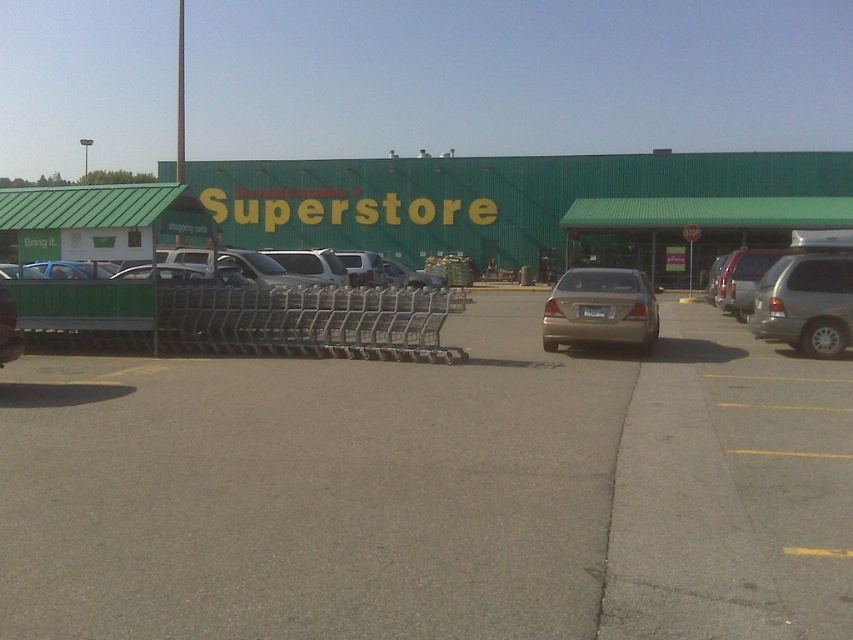
You are a delivery driver who needs to park your truck in the parking lot. You see a matte silver suv at center and a matte silver sedan at center. Which vehicle should you avoid parking too close to to prevent blocking the other?

You should avoid parking too close to the matte silver suv at center because it is positioned under the matte silver sedan at center, meaning it might be in a lower parking space or closer to the ground, and blocking it could obstruct access to the sedan above.

Based on the photo, you are driving a car that is 5 meters long and need to park in the parking lot shown. The satin silver suv at right is parked 14.26 meters away from the beige sedan near the center. Is there enough space between them to park your car?

The satin silver suv at right and the beige sedan near the center are 14.26 meters apart. Since your car is only 5 meters long, there is sufficient space between them to park your car.

You are a customer arriving at the Superstore parking lot. You see a gold matte sedan at center and a matte silver suv at center. Which vehicle is parked closer to the entrance of the store?

The gold matte sedan at center is located below the matte silver suv at center. Since the entrance is at the bottom of the image, the gold matte sedan at center is closer to the entrance.